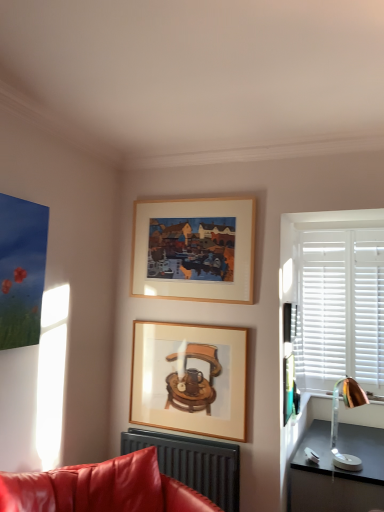
Question: Does metallic gold lamp at right have a larger size compared to matte black radiator at lower center?

Choices:
 (A) no
 (B) yes

Answer: (A)

Question: Would you say metallic gold lamp at right contains matte black radiator at lower center?

Choices:
 (A) no
 (B) yes

Answer: (A)

Question: Is metallic gold lamp at right turned away from matte black radiator at lower center?

Choices:
 (A) yes
 (B) no

Answer: (B)

Question: Is metallic gold lamp at right behind matte black radiator at lower center?

Choices:
 (A) yes
 (B) no

Answer: (A)

Question: Does metallic gold lamp at right have a smaller size compared to matte black radiator at lower center?

Choices:
 (A) yes
 (B) no

Answer: (A)

Question: Considering the positions of wooden frame at upper center, the 1th picture frame viewed from the top, and matte black radiator at lower center in the image, is wooden frame at upper center, the 1th picture frame viewed from the top, taller or shorter than matte black radiator at lower center?

Choices:
 (A) short
 (B) tall

Answer: (B)

Question: Considering the relative positions of wooden frame at upper center, which ranks as the second picture frame in bottom-to-top order, and matte black radiator at lower center in the image provided, is wooden frame at upper center, which ranks as the second picture frame in bottom-to-top order, to the left or to the right of matte black radiator at lower center?

Choices:
 (A) right
 (B) left

Answer: (A)

Question: Is wooden frame at upper center, which ranks as the second picture frame in bottom-to-top order, situated inside matte black radiator at lower center or outside?

Choices:
 (A) outside
 (B) inside

Answer: (A)

Question: From the image's perspective, is wooden frame at upper center, the 1th picture frame viewed from the top, positioned above or below matte black radiator at lower center?

Choices:
 (A) above
 (B) below

Answer: (A)

Question: Considering the positions of metallic gold lamp at right and copper metallic table lamp at right in the image, is metallic gold lamp at right taller or shorter than copper metallic table lamp at right?

Choices:
 (A) short
 (B) tall

Answer: (A)

Question: Looking at their shapes, would you say metallic gold lamp at right is wider or thinner than copper metallic table lamp at right?

Choices:
 (A) wide
 (B) thin

Answer: (B)

Question: Is metallic gold lamp at right bigger or smaller than copper metallic table lamp at right?

Choices:
 (A) big
 (B) small

Answer: (B)

Question: From a real-world perspective, is metallic gold lamp at right positioned above or below copper metallic table lamp at right?

Choices:
 (A) above
 (B) below

Answer: (B)

Question: From the image's perspective, is wooden frame at upper center, the 1th picture frame viewed from the top, positioned above or below copper metallic table lamp at right?

Choices:
 (A) below
 (B) above

Answer: (B)

Question: Is wooden frame at upper center, which ranks as the second picture frame in bottom-to-top order, in front of or behind copper metallic table lamp at right in the image?

Choices:
 (A) front
 (B) behind

Answer: (B)